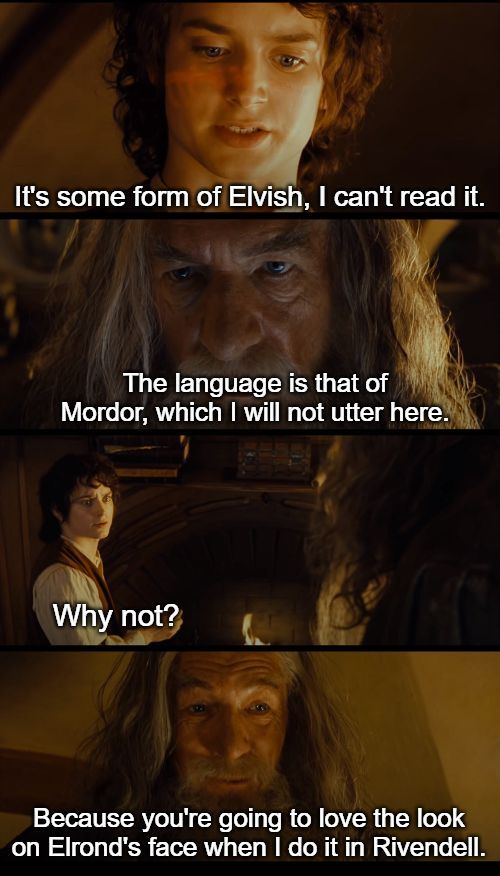
Where is `wall`? The height and width of the screenshot is (876, 500). wall is located at coordinates (439, 705), (77, 81).